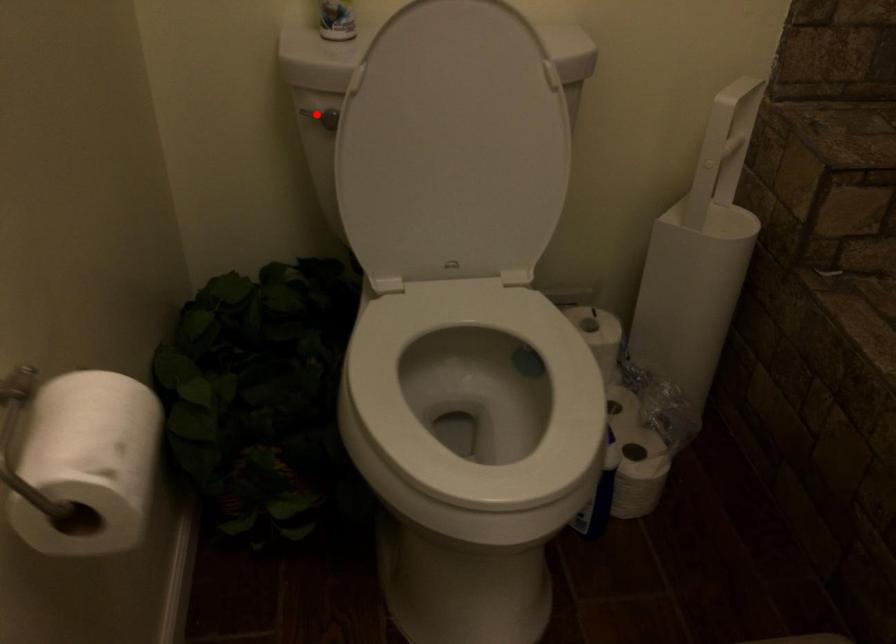
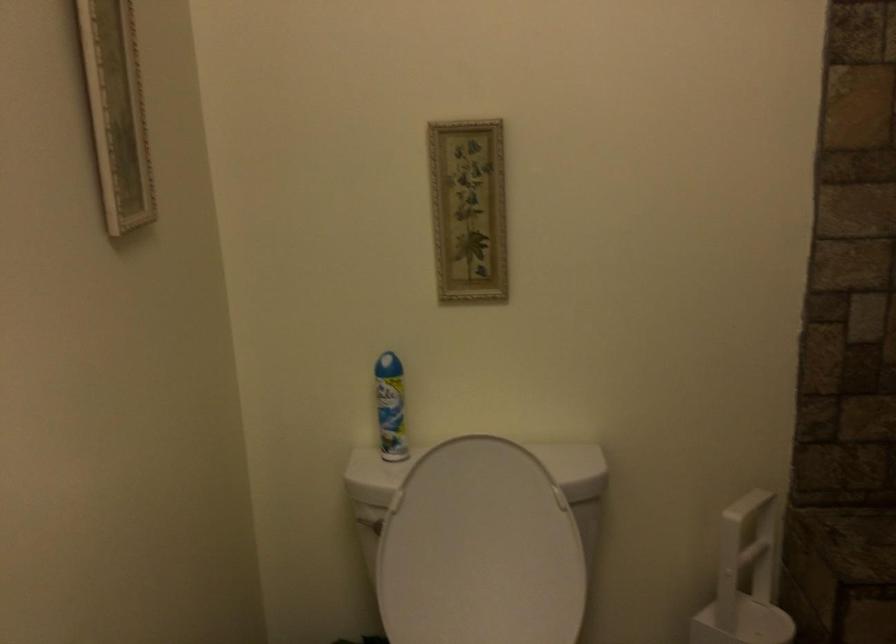
In the second image, find the point that corresponds to the highlighted location in the first image.

(368, 522)